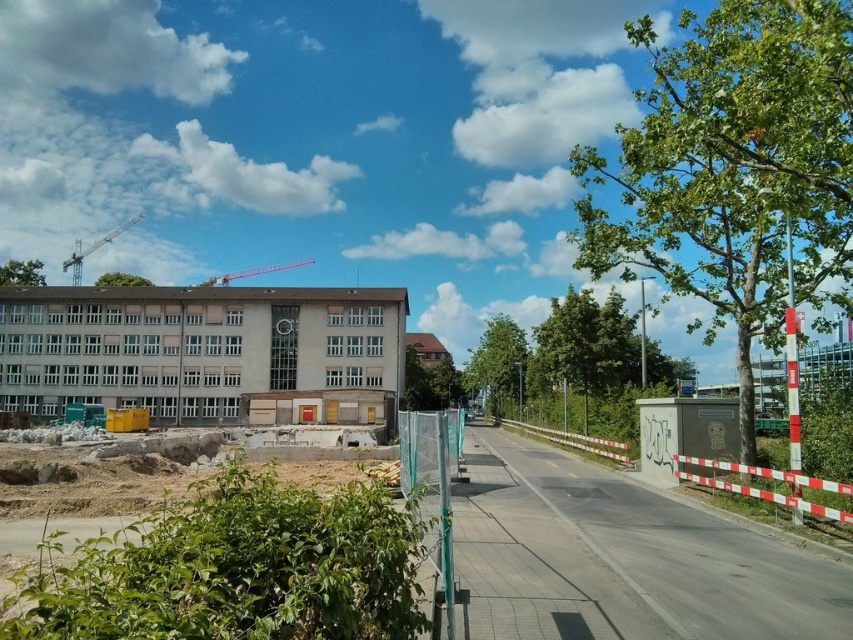
You are a delivery person trying to navigate through the urban area shown. You need to pass between the metallic red crane at upper center and the green leafy tree at upper center. Given that your delivery van is 2 meters wide, can you safely maneuver through the space between them?

The metallic red crane at upper center has a lesser width compared to the green leafy tree at upper center. However, the description does not provide information about the distance between them. Without knowing the space between the two objects, it is impossible to determine if the van can safely pass through.

You are a construction worker standing on the sidewalk and need to lift materials to the top floor of the building. Which crane, the green metallic crane at upper left or the metallic red crane at upper center, is better suited for this task? Explain your choice based on their positions and sizes.

The green metallic crane at upper left is much taller than the metallic red crane at upper center, making it better suited for lifting materials to the top floor of the building.